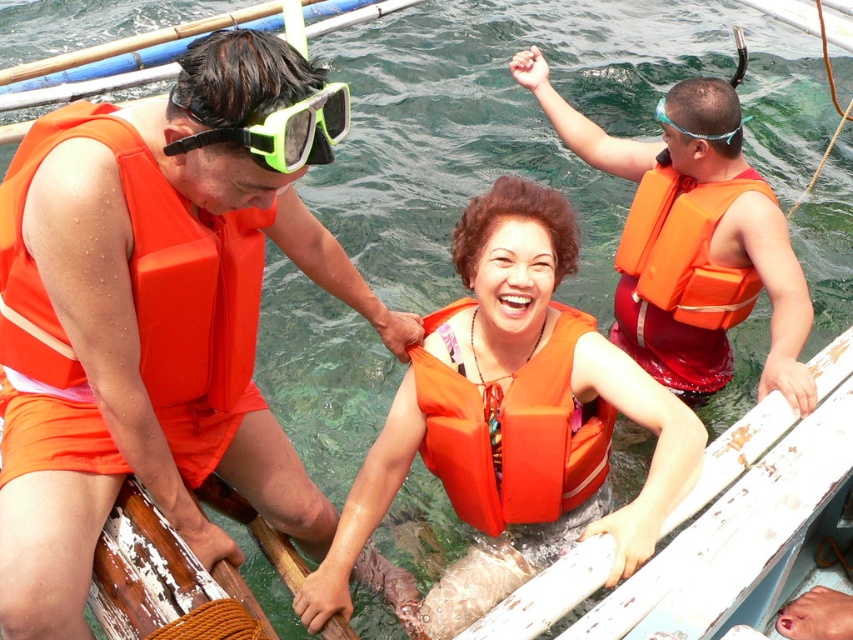
Which is more to the right, orange foam life jacket at left or orange matte life jacket at right?

orange matte life jacket at right

Looking at this image, who is more distant from viewer, (171, 403) or (686, 301)?

Point (686, 301)

This screenshot has height=640, width=853. What are the coordinates of `orange foam life jacket at left` in the screenshot? It's located at (140, 275).

Can you confirm if orange life vest at left is bigger than orange life vest at center?

Indeed, orange life vest at left has a larger size compared to orange life vest at center.

Who is more distant from viewer, [213,424] or [581,424]?

Positioned behind is point [581,424].

Image resolution: width=853 pixels, height=640 pixels. Identify the location of orange life vest at left. (157, 314).

Does orange life vest at left appear on the left side of orange matte life jacket at center?

Yes, orange life vest at left is to the left of orange matte life jacket at center.

Who is shorter, orange life vest at left or orange matte life jacket at center?

Standing shorter between the two is orange matte life jacket at center.

What do you see at coordinates (157, 314) in the screenshot? The height and width of the screenshot is (640, 853). I see `orange life vest at left` at bounding box center [157, 314].

Image resolution: width=853 pixels, height=640 pixels. In order to click on orange life vest at left in this screenshot , I will do `click(157, 314)`.